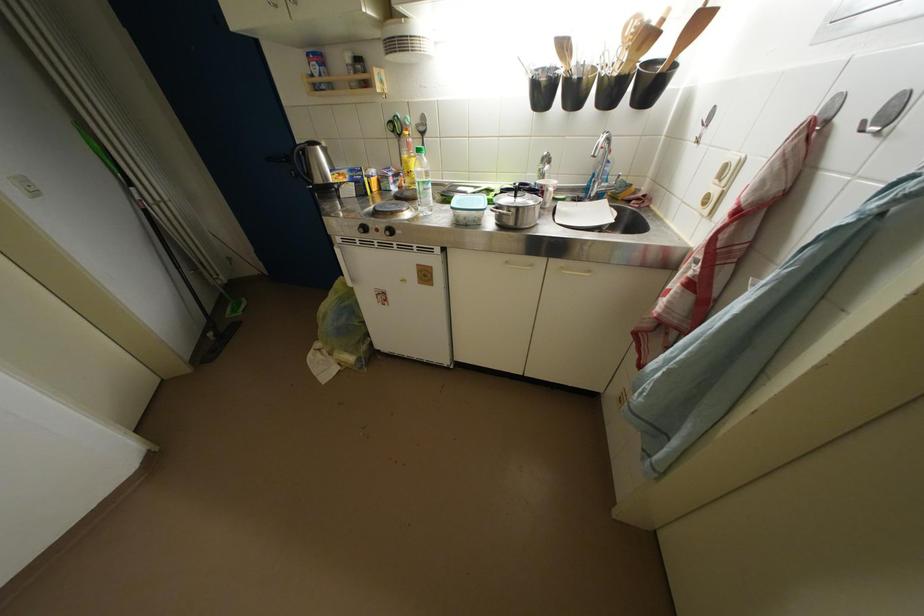
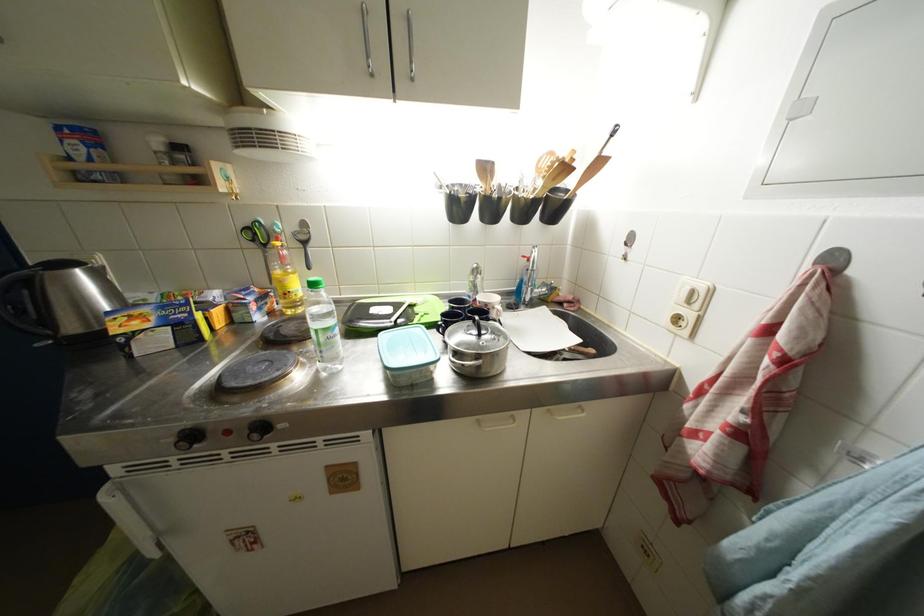
Locate, in the second image, the point that corresponds to point (407, 140) in the first image.

(272, 249)